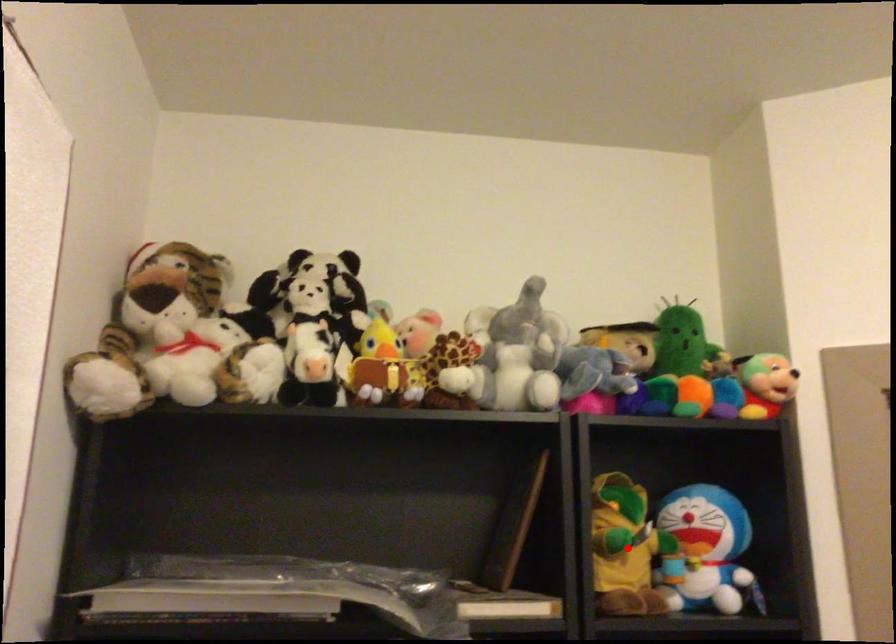
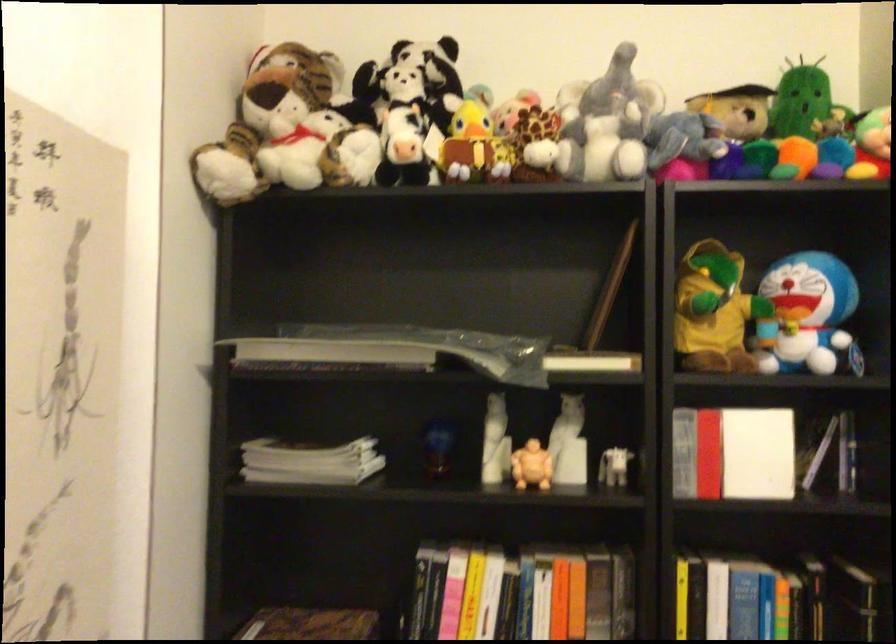
Where in the second image is the point corresponding to the highlighted location from the first image?

(713, 310)